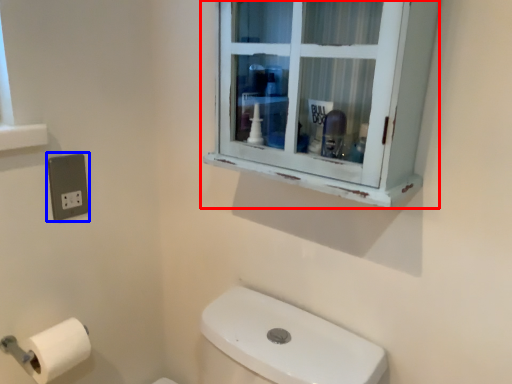
Question: Which of the following is the closest to the observer, window (highlighted by a red box) or electric outlet (highlighted by a blue box)?

Choices:
 (A) window
 (B) electric outlet

Answer: (A)